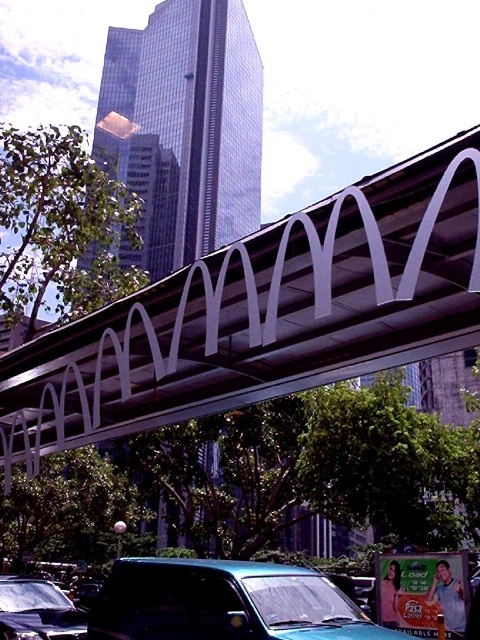
Question: Does metallic silver pedestrian bridge at center have a smaller size compared to teal matte van at lower center?

Choices:
 (A) yes
 (B) no

Answer: (B)

Question: Which object appears closest to the camera in this image?

Choices:
 (A) teal matte van at lower center
 (B) shiny black car at lower left
 (C) metallic silver pedestrian bridge at center

Answer: (C)

Question: Which object appears closest to the camera in this image?

Choices:
 (A) teal matte van at lower center
 (B) metallic silver pedestrian bridge at center
 (C) shiny black car at lower left

Answer: (B)

Question: Which object is the farthest from the metallic silver pedestrian bridge at center?

Choices:
 (A) shiny black car at lower left
 (B) teal matte van at lower center

Answer: (A)

Question: Does metallic silver pedestrian bridge at center appear under teal matte van at lower center?

Choices:
 (A) yes
 (B) no

Answer: (B)

Question: Is metallic silver pedestrian bridge at center smaller than teal matte van at lower center?

Choices:
 (A) no
 (B) yes

Answer: (A)